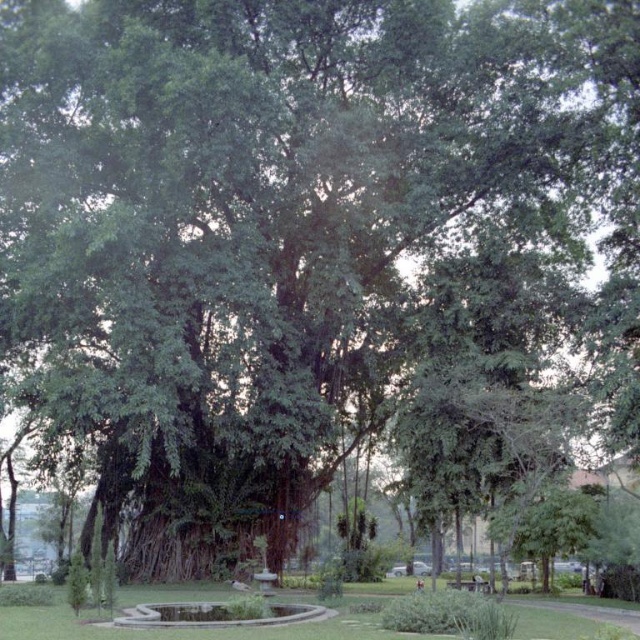
Question: Does green grass at center lie behind wooden park bench at center?

Choices:
 (A) yes
 (B) no

Answer: (B)

Question: Which point appears closest to the camera in this image?

Choices:
 (A) (381, 637)
 (B) (476, 589)

Answer: (A)

Question: Is green grass at center bigger than wooden park bench at center?

Choices:
 (A) no
 (B) yes

Answer: (B)

Question: Does green grass at center have a greater width compared to wooden park bench at center?

Choices:
 (A) no
 (B) yes

Answer: (B)